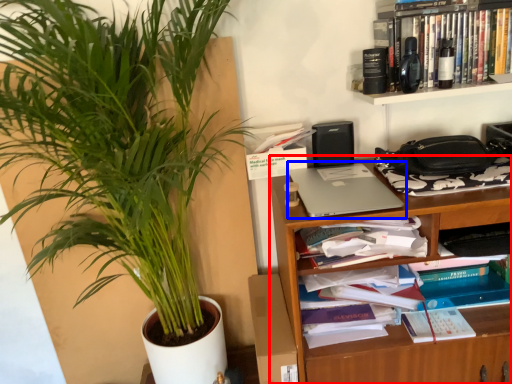
Question: Among these objects, which one is nearest to the camera, shelf (highlighted by a red box) or laptop (highlighted by a blue box)?

Choices:
 (A) shelf
 (B) laptop

Answer: (A)